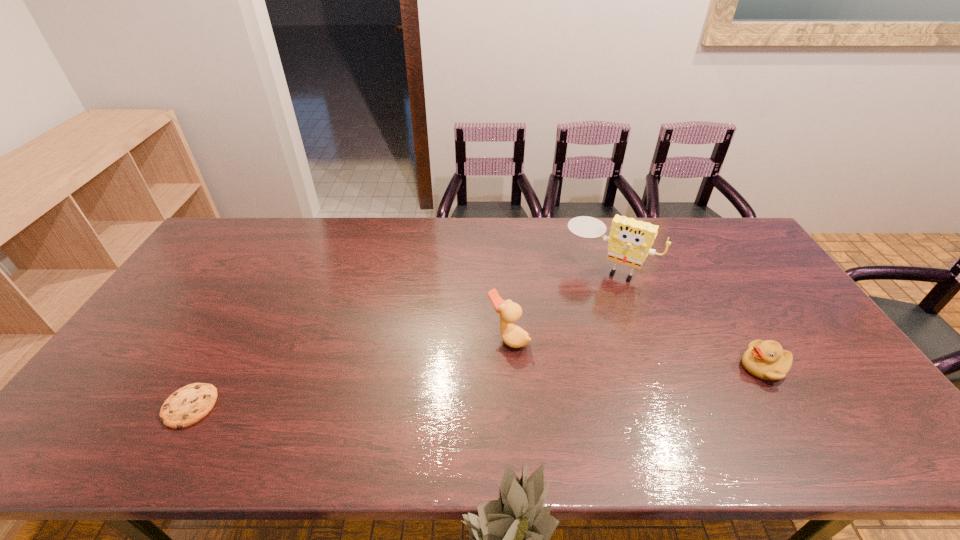
I want to click on the shortest object, so click(x=188, y=405).

Where is `cookie`? This screenshot has width=960, height=540. cookie is located at coordinates (188, 405).

Locate an element on the screen. duckling is located at coordinates (767, 360).

Locate an element on the screen. The height and width of the screenshot is (540, 960). the rightmost object is located at coordinates (767, 360).

Find the location of a particular element. the second object from right to left is located at coordinates (630, 241).

The image size is (960, 540). Identify the location of sponge. (630, 241).

The width and height of the screenshot is (960, 540). I want to click on the third object from right to left, so click(x=512, y=335).

This screenshot has width=960, height=540. In order to click on the second tallest object in this screenshot , I will do `click(512, 335)`.

Image resolution: width=960 pixels, height=540 pixels. I want to click on vacant space located on the back of the cookie, so click(243, 312).

Where is `free spot located at the beak of the rightmost object`? The image size is (960, 540). free spot located at the beak of the rightmost object is located at coordinates (703, 367).